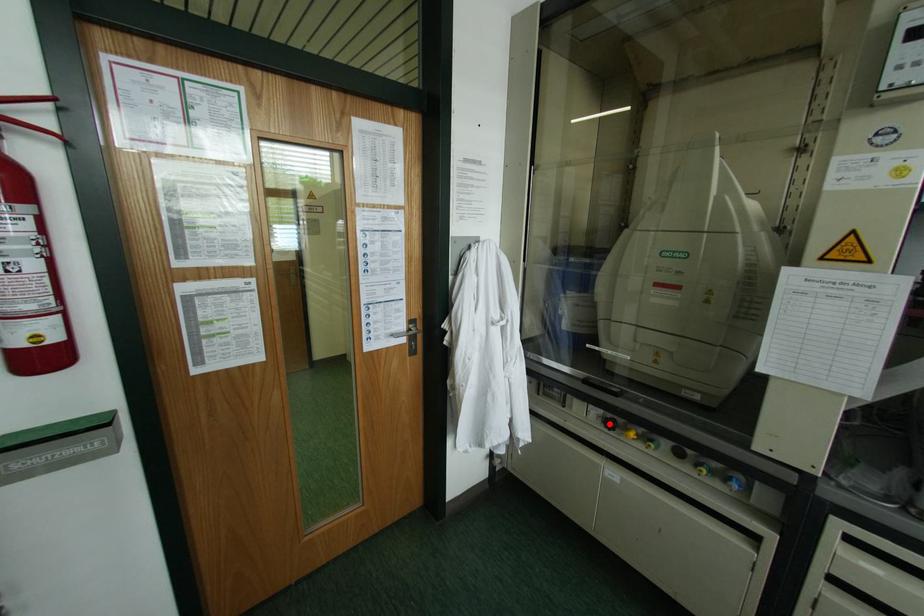
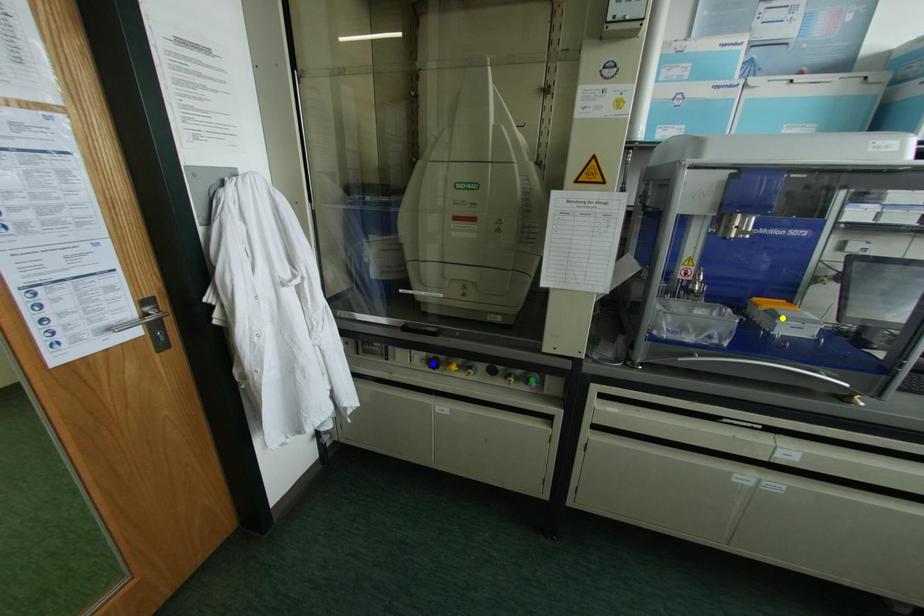
Question: I am providing you with two images of the same scene from different viewpoints. A red point is marked on the first image. You are given multiple points on the second image. Which spot in image 2 lines up with the point in image 1?

Choices:
 (A) blue point
 (B) green point
 (C) yellow point

Answer: (A)